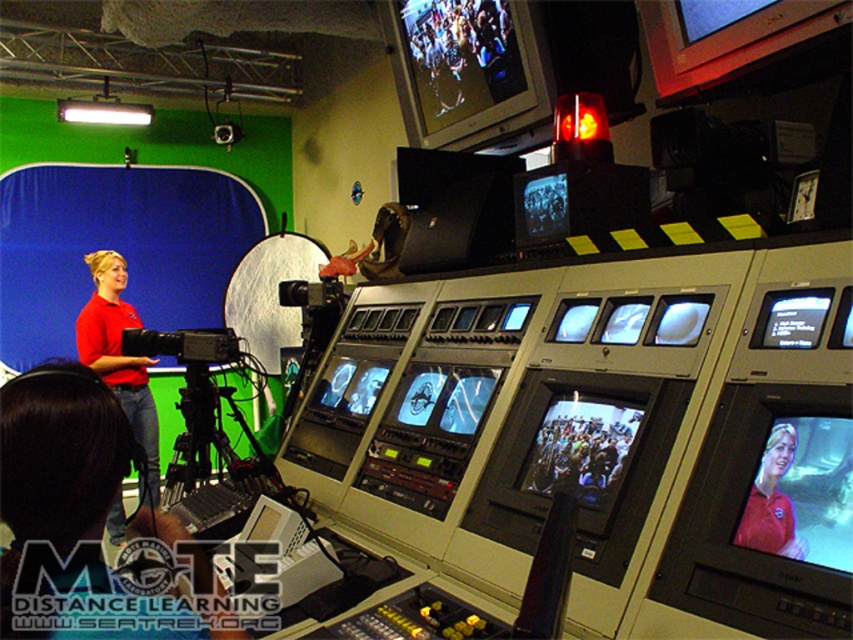
You are a technician in the control room and need to adjust two points on the control panel. The first point is at coordinate point (167, 337) and the second is at point (755, 346). Which point is closer to you?

Point (167, 337) is closer to you because it is further to the viewer than point (755, 346).

You are a technician in the studio and need to adjust the matte black video camera at left. To reach it, you must pass by the red shirt at left. Since the camera is above the shirt, will you need to duck to avoid bumping your head?

The matte black video camera at left is located above the red shirt at left, so you will need to duck to avoid bumping your head when passing by the red shirt at left.